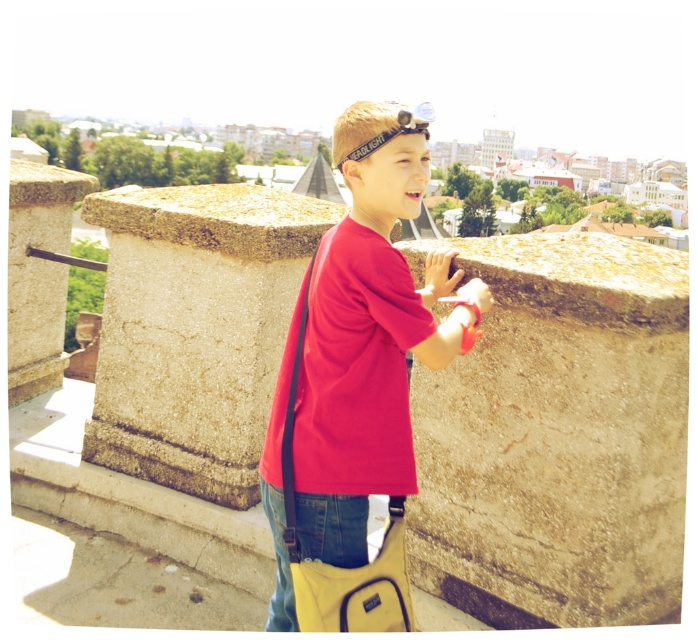
You are a drone operator trying to navigate between two points in the city. The first point is point (208, 442) and the second point is point (401, 401). According to the scene, which point is closer to the camera?

Point (401, 401) is closer to the camera because it is in front of point (208, 442).